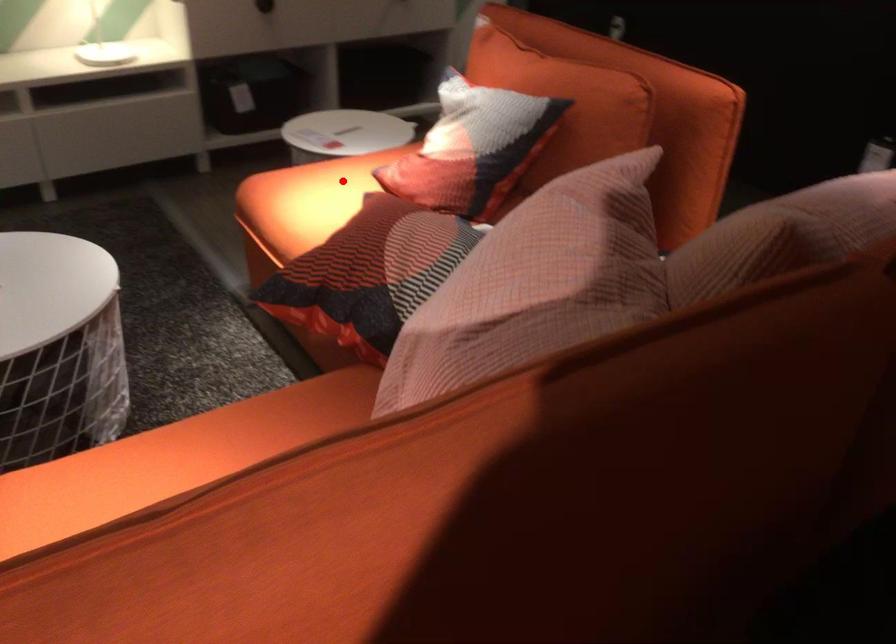
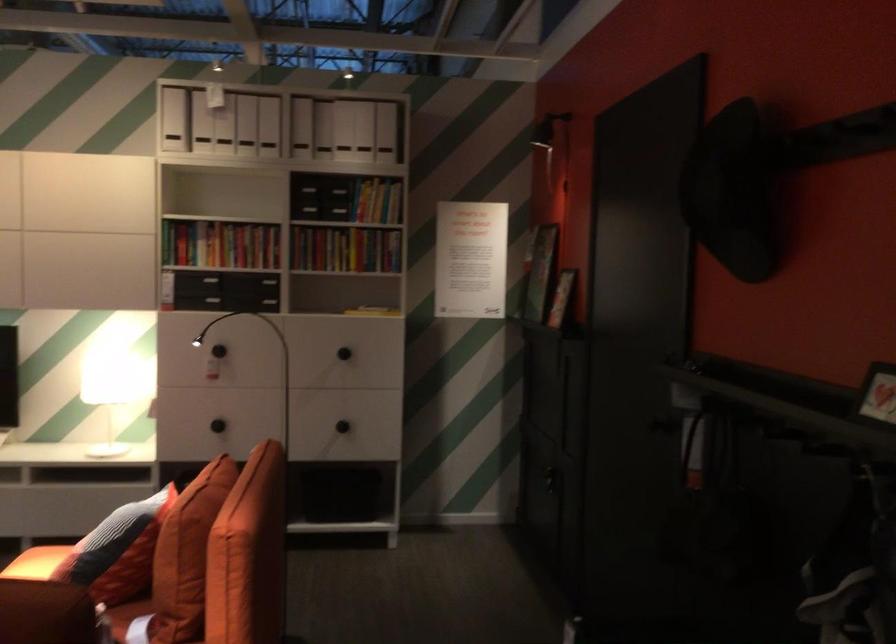
Locate, in the second image, the point that corresponds to the highlighted location in the first image.

(36, 563)